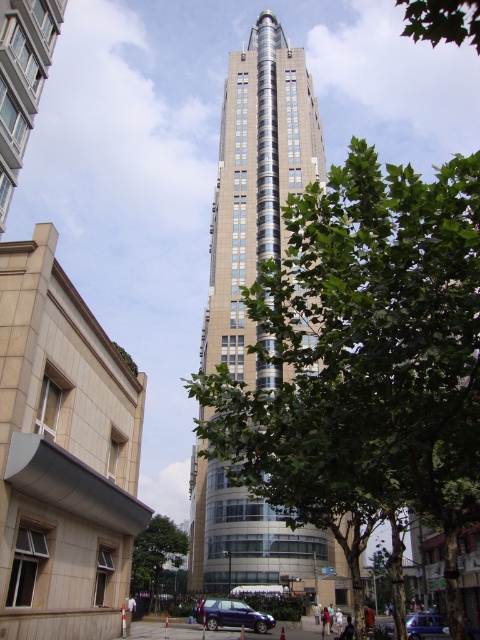
You are a delivery driver approaching the tall building in the image. You see the green leafy tree at center and the metallic blue suv at lower center. Which object is closer to you as you drive towards the tall building?

The metallic blue suv at lower center is closer to you because it is positioned at the lower center, which is typically nearer to the observer in such scenes, whereas the green leafy tree at center might be further back. However, according to the description, the green leafy tree at center is larger than the metallic blue suv at lower center, which might indicate it is closer. But since the question is about proximity while driving towards the tall building, the SUV at lower center is more likely in the 1.

Looking at this image, you are standing in the urban landscape and want to take a photo of both the point at coordinates point (225, 406) and point (475, 29). Which point should you focus on first to ensure both are in focus?

You should focus on point (475, 29) first because it is closer to the camera than point (225, 406). By focusing on the closer point, the farther point will also be within the depth of field, ensuring both are in focus.

You are standing at the base of the tall multi story building and want to walk to the green leafy tree at upper right. There is a path that goes past the green leafy tree at center. How far will you walk from the tree at center to the tree at upper right?

The green leafy tree at center is 26.74 meters away from green leafy tree at upper right, so you will walk 26.74 meters from the tree at center to the tree at upper right.